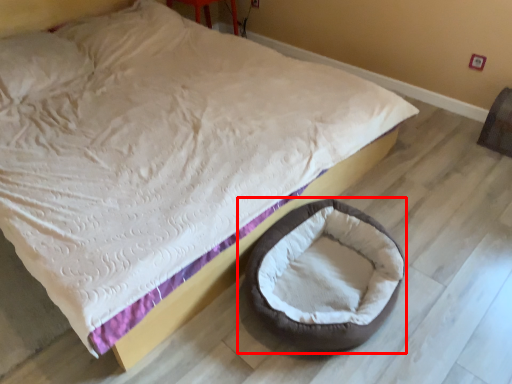
Question: From the image's perspective, considering the relative positions of dog bed (annotated by the red box) and bean bag chair in the image provided, where is dog bed (annotated by the red box) located with respect to the staircase?

Choices:
 (A) above
 (B) below

Answer: (B)